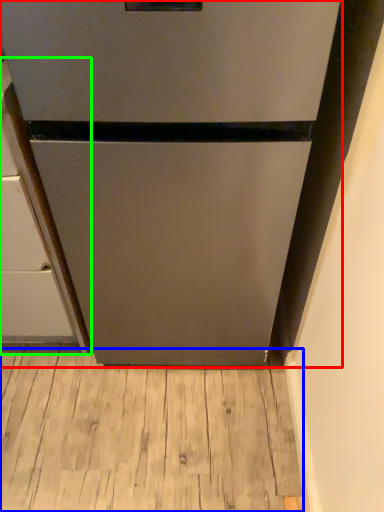
Question: Which object is positioned closest to refrigerator (highlighted by a red box)? Select from hardwood (highlighted by a blue box) and cabinetry (highlighted by a green box).

Choices:
 (A) hardwood
 (B) cabinetry

Answer: (B)